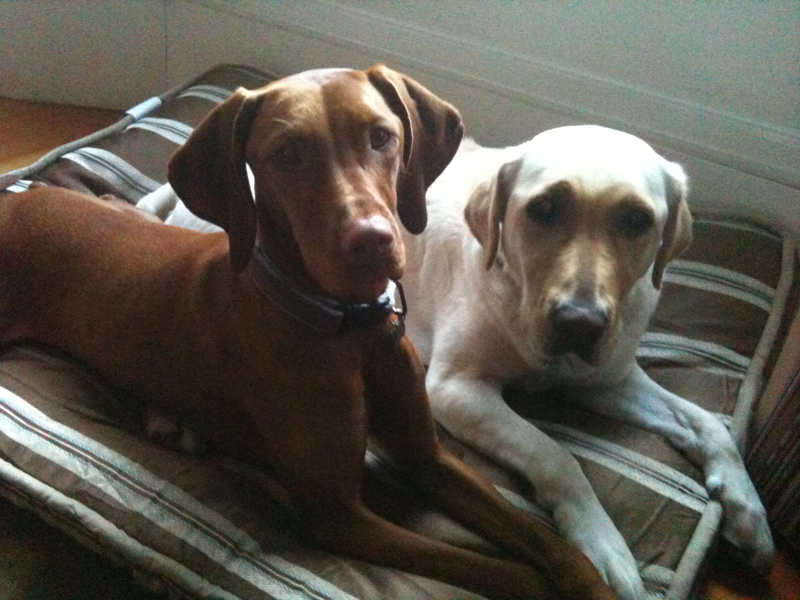
Find the location of a particular element. This screenshot has height=600, width=800. white wall is located at coordinates pyautogui.click(x=670, y=82).